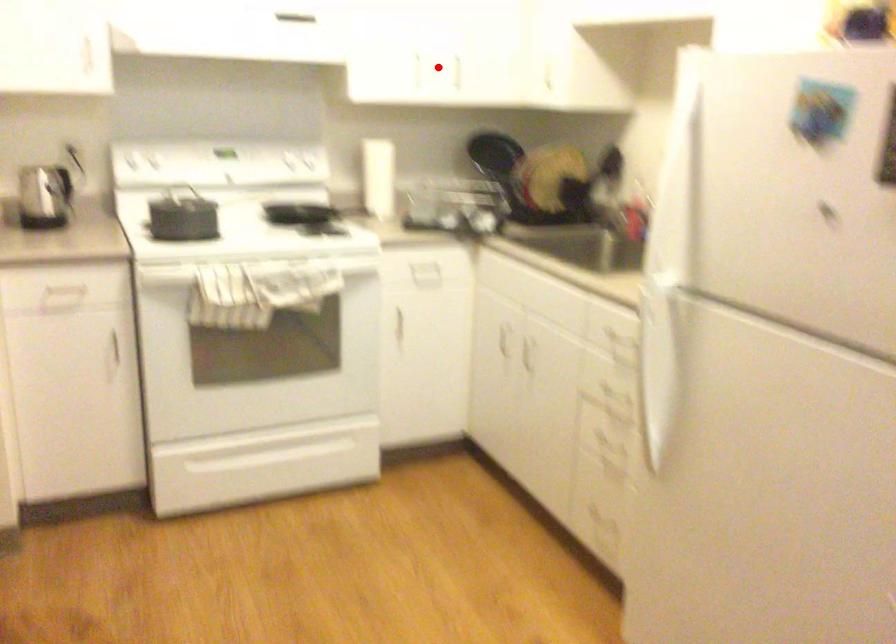
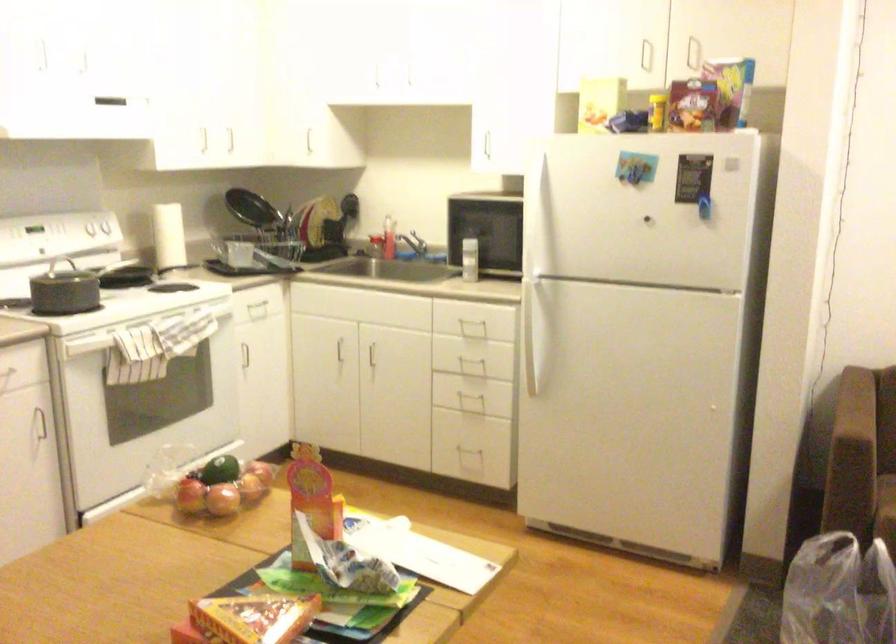
Question: I am providing you with two images of the same scene from different viewpoints. Image1 has a red point marked. In image2, the corresponding 3D location appears at what relative position? Reply with the corresponding letter.

Choices:
 (A) Closer
 (B) Farther

Answer: (B)